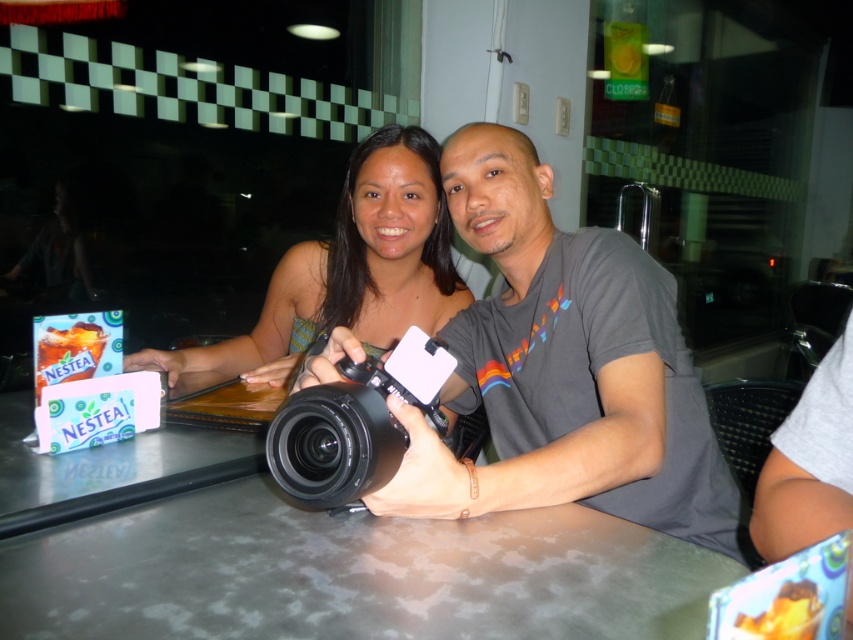
Question: Which of the following is the closest to the observer?

Choices:
 (A) (465, 161)
 (B) (349, 256)

Answer: (A)

Question: Can you confirm if matte black camera at center is thinner than black plastic video camera at center?

Choices:
 (A) yes
 (B) no

Answer: (B)

Question: Which point is closer to the camera?

Choices:
 (A) (662, 413)
 (B) (286, 483)

Answer: (B)

Question: Is matte black camera at center smaller than black plastic video camera at center?

Choices:
 (A) yes
 (B) no

Answer: (B)

Question: In this image, where is matte black camera at center located relative to black plastic video camera at center?

Choices:
 (A) right
 (B) left

Answer: (B)

Question: Which point is closer to the camera?

Choices:
 (A) black plastic video camera at center
 (B) black matte camera at center

Answer: (A)